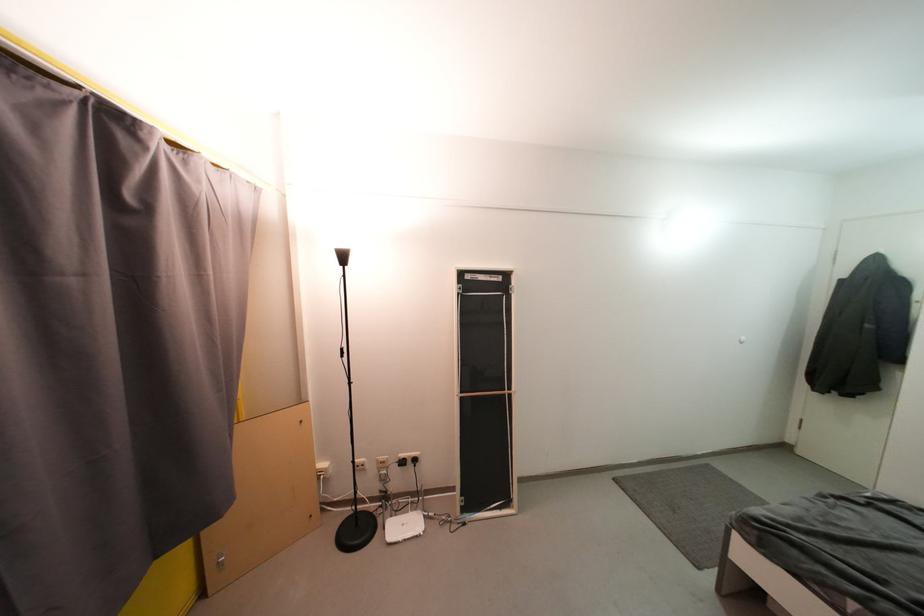
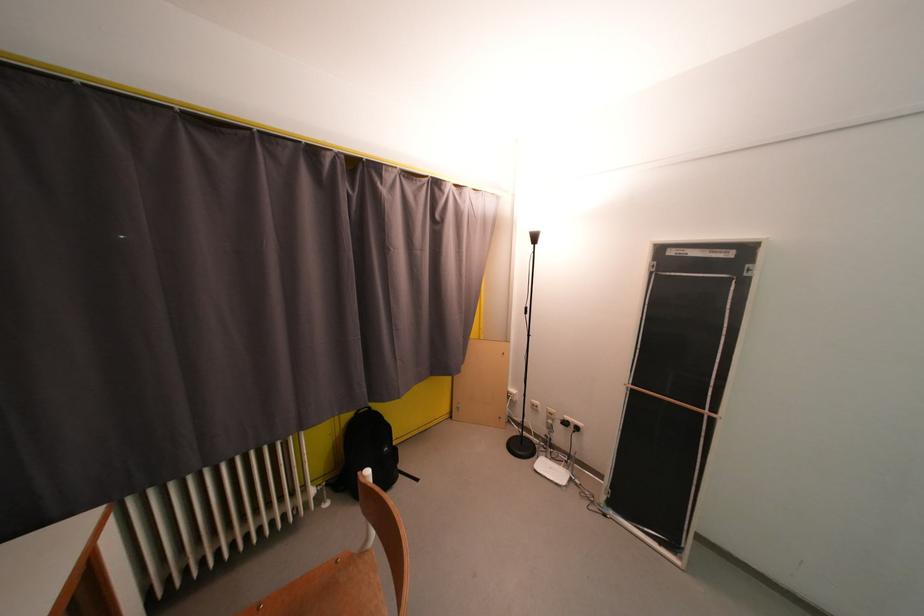
Question: Based on the continuous images, in which direction is the camera rotating? Reply with the corresponding letter.

Choices:
 (A) Left
 (B) Right
 (C) Up
 (D) Down

Answer: (A)